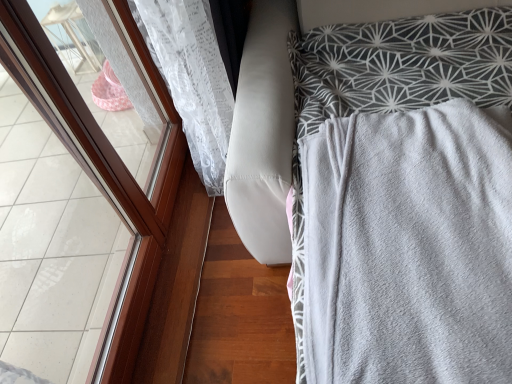
Question: Is gray soft blanket at right smaller than brown wooden frame at left?

Choices:
 (A) no
 (B) yes

Answer: (A)

Question: From the image's perspective, does gray soft blanket at right appear higher than brown wooden frame at left?

Choices:
 (A) no
 (B) yes

Answer: (A)

Question: From a real-world perspective, is gray soft blanket at right located higher than brown wooden frame at left?

Choices:
 (A) no
 (B) yes

Answer: (A)

Question: From a real-world perspective, is gray soft blanket at right beneath brown wooden frame at left?

Choices:
 (A) yes
 (B) no

Answer: (A)

Question: Is the surface of gray soft blanket at right in direct contact with brown wooden frame at left?

Choices:
 (A) yes
 (B) no

Answer: (B)

Question: Is gray soft blanket at right bigger than brown wooden frame at left?

Choices:
 (A) no
 (B) yes

Answer: (B)

Question: Is brown wooden frame at left beside gray soft blanket at right?

Choices:
 (A) yes
 (B) no

Answer: (B)

Question: Does brown wooden frame at left have a smaller size compared to gray soft blanket at right?

Choices:
 (A) no
 (B) yes

Answer: (B)

Question: Does brown wooden frame at left have a lesser width compared to gray soft blanket at right?

Choices:
 (A) no
 (B) yes

Answer: (B)

Question: Are brown wooden frame at left and gray soft blanket at right far apart?

Choices:
 (A) no
 (B) yes

Answer: (A)

Question: From the image's perspective, would you say brown wooden frame at left is shown under gray soft blanket at right?

Choices:
 (A) no
 (B) yes

Answer: (A)

Question: Considering the relative sizes of brown wooden frame at left and gray soft blanket at right in the image provided, is brown wooden frame at left taller than gray soft blanket at right?

Choices:
 (A) yes
 (B) no

Answer: (A)

Question: From a real-world perspective, is gray soft blanket at right positioned above or below brown wooden frame at left?

Choices:
 (A) above
 (B) below

Answer: (B)